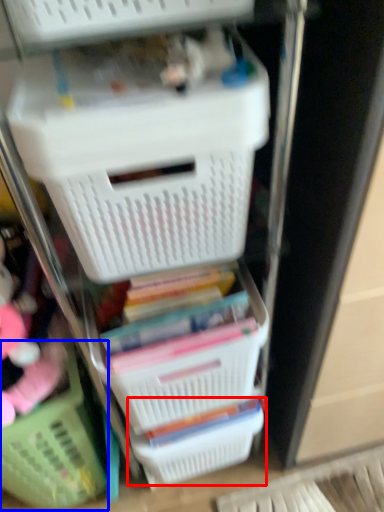
Question: Which object appears closest to the camera in this image, basket (highlighted by a red box) or basket (highlighted by a blue box)?

Choices:
 (A) basket
 (B) basket

Answer: (B)